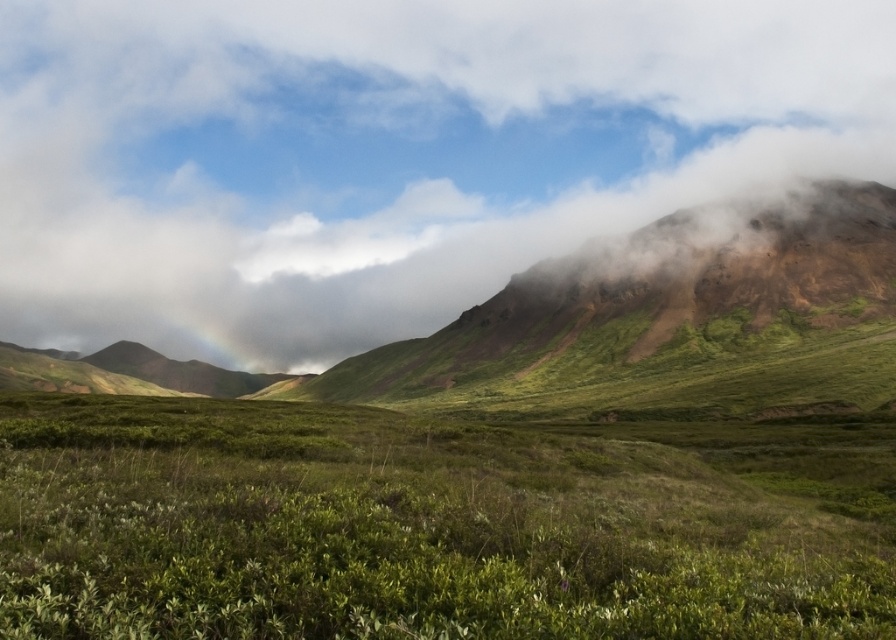
You are a bird soaring above the landscape. You see the white fluffy cloud at upper center and the green matte grass at center. Which object is higher in the sky?

The white fluffy cloud at upper center is higher in the sky because it is taller than the green matte grass at center.

You are an artist trying to paint this landscape. You notice the white fluffy cloud at upper center and the green matte grass at center. Which object should you make larger in your painting to accurately represent their sizes as seen in the image?

The white fluffy cloud at upper center should be made larger than the green matte grass at center in the painting to accurately represent their sizes as seen in the image.

Consider the image. You are a hiker standing at the edge of the green matte grass at center, looking towards the white fluffy cloud at upper center. Which object is closer to you?

The white fluffy cloud at upper center is closer to you because the green matte grass at center is behind it.